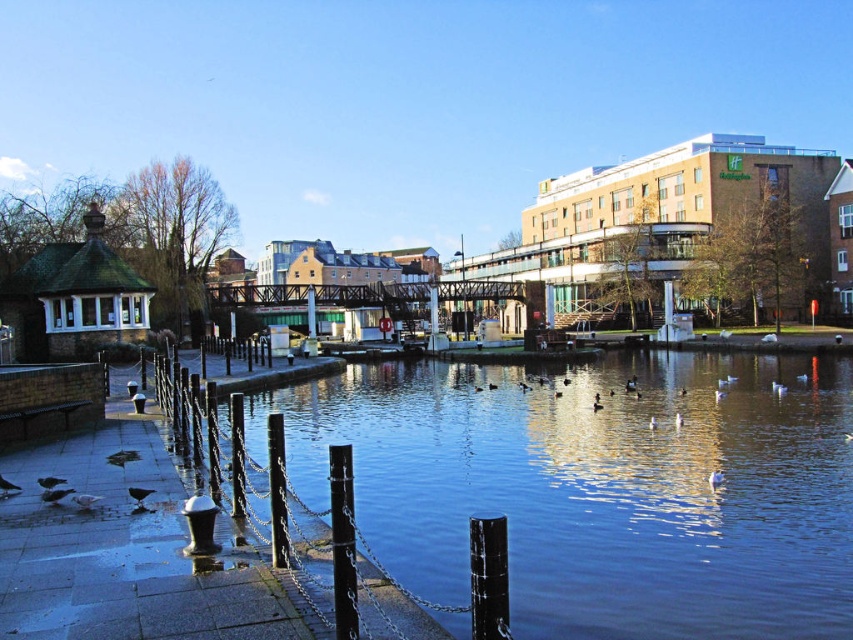
Is blue water at center to the right of black metal pole at lower center from the viewer's perspective?

Correct, you'll find blue water at center to the right of black metal pole at lower center.

Is blue water at center positioned behind black metal pole at lower center?

Yes, blue water at center is behind black metal pole at lower center.

Is point (525, 596) less distant than point (352, 636)?

No.

The image size is (853, 640). I want to click on blue water at center, so click(x=599, y=486).